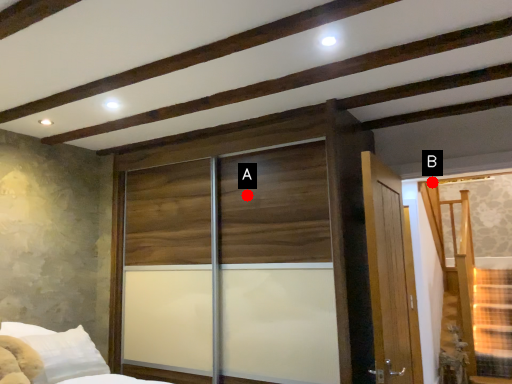
Question: Two points are circled on the image, labeled by A and B beside each circle. Which point is farther to the camera?

Choices:
 (A) A is further
 (B) B is further

Answer: (B)